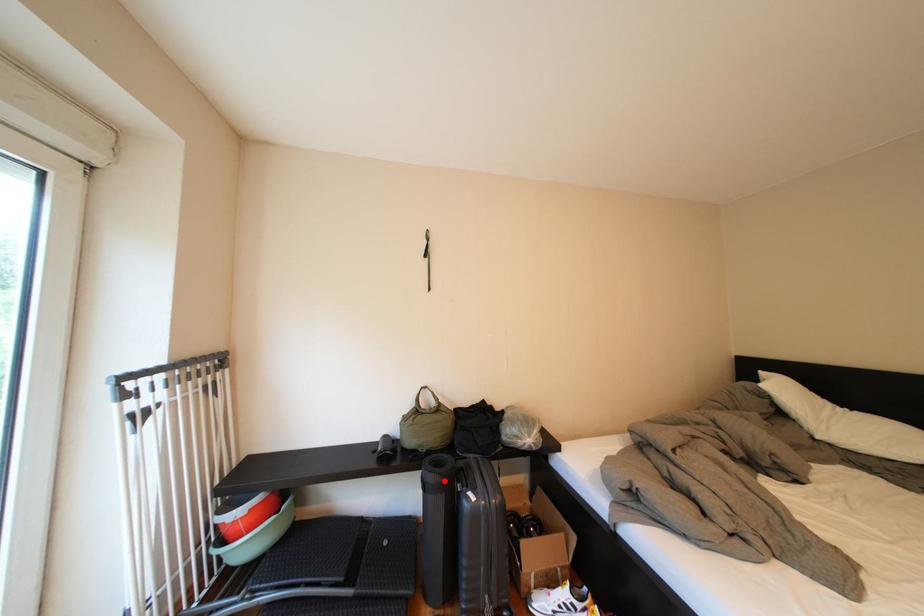
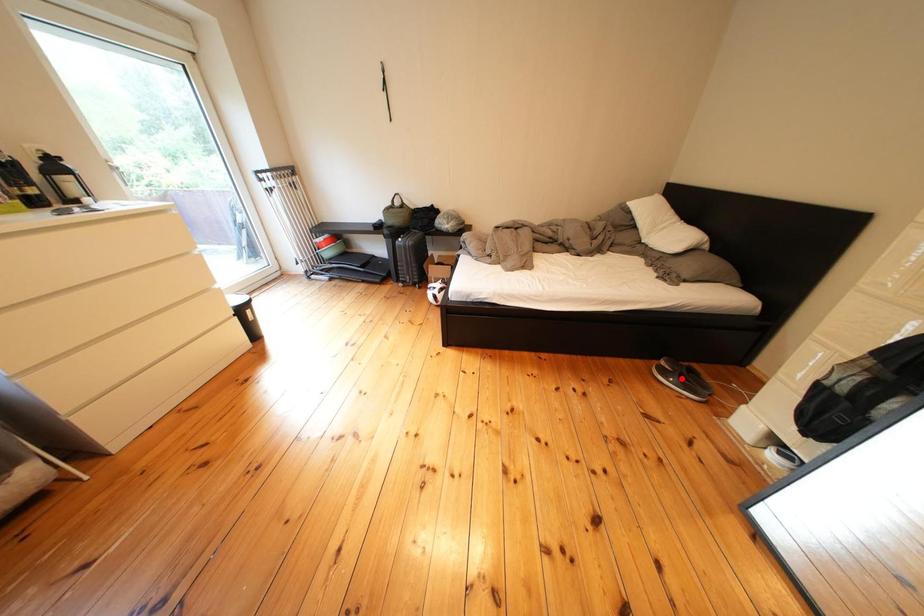
I am providing you with two images of the same scene from different viewpoints. A red point is marked on the first image and another point is marked on the second image. Are the points marked in image1 and image2 representing the same 3D position?

No